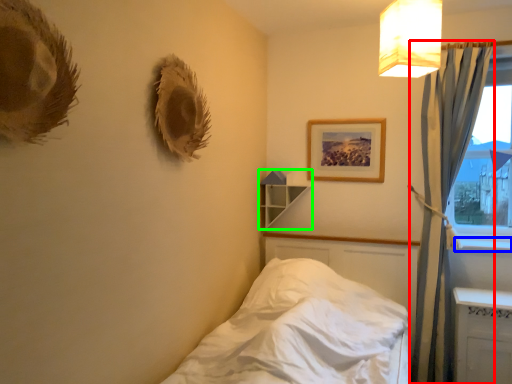
Question: Which object is positioned closest to curtain (highlighted by a red box)? Select from window sill (highlighted by a blue box) and shelf (highlighted by a green box).

Choices:
 (A) window sill
 (B) shelf

Answer: (A)